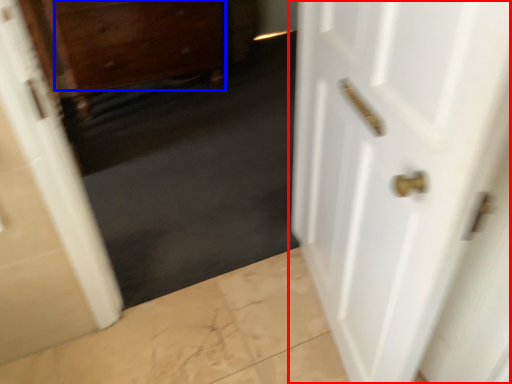
Question: Which object is closer to the camera taking this photo, door (highlighted by a red box) or drawer (highlighted by a blue box)?

Choices:
 (A) door
 (B) drawer

Answer: (A)